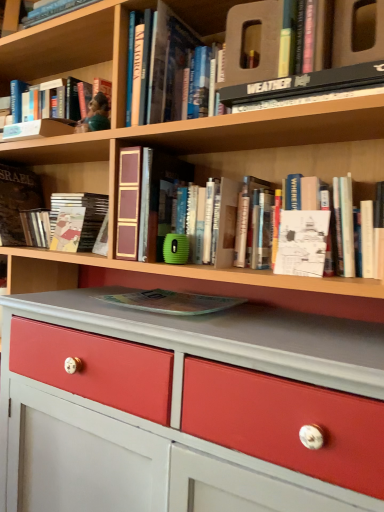
Question: From a real-world perspective, is black hardcover book at upper center, acting as the seventh book starting from the left, over white paper at center?

Choices:
 (A) no
 (B) yes

Answer: (B)

Question: Would you say black hardcover book at upper center, acting as the seventh book starting from the left, contains white paper at center?

Choices:
 (A) no
 (B) yes

Answer: (A)

Question: Can you confirm if black hardcover book at upper center, acting as the seventh book starting from the left, is taller than white paper at center?

Choices:
 (A) yes
 (B) no

Answer: (B)

Question: Would you say black hardcover book at upper center, the 2th book when ordered from right to left, is outside white paper at center?

Choices:
 (A) no
 (B) yes

Answer: (B)

Question: Is black hardcover book at upper center, the 2th book when ordered from right to left, looking in the opposite direction of white paper at center?

Choices:
 (A) yes
 (B) no

Answer: (B)

Question: Would you say black hardcover book at upper center, the 2th book when ordered from right to left, is to the left or to the right of white paper book at upper right, which is the eighth book from left to right, in the picture?

Choices:
 (A) left
 (B) right

Answer: (A)

Question: From a real-world perspective, is black hardcover book at upper center, the 2th book when ordered from right to left, physically located above or below white paper book at upper right, which is the eighth book from left to right?

Choices:
 (A) below
 (B) above

Answer: (B)

Question: Is point (369, 61) closer or farther from the camera than point (274, 148)?

Choices:
 (A) closer
 (B) farther

Answer: (A)

Question: Considering the positions of black hardcover book at upper center, the 2th book when ordered from right to left, and white paper book at upper right, placed as the 1th book when sorted from right to left, in the image, is black hardcover book at upper center, the 2th book when ordered from right to left, wider or thinner than white paper book at upper right, placed as the 1th book when sorted from right to left,?

Choices:
 (A) thin
 (B) wide

Answer: (B)

Question: In terms of width, does white paper book at upper right, which is the eighth book from left to right, look wider or thinner when compared to black hardcover book at upper center, the 2th book when ordered from right to left?

Choices:
 (A) thin
 (B) wide

Answer: (A)

Question: Based on their sizes in the image, would you say white paper book at upper right, placed as the 1th book when sorted from right to left, is bigger or smaller than black hardcover book at upper center, the 2th book when ordered from right to left?

Choices:
 (A) small
 (B) big

Answer: (B)

Question: Considering their positions, is white paper book at upper right, placed as the 1th book when sorted from right to left, located in front of or behind black hardcover book at upper center, acting as the seventh book starting from the left?

Choices:
 (A) behind
 (B) front

Answer: (A)

Question: Does point (274, 160) appear closer or farther from the camera than point (288, 92)?

Choices:
 (A) farther
 (B) closer

Answer: (A)

Question: From the image's perspective, is brown leather book at left, marked as the 8th book in a right-to-left arrangement, located above or below transparent plastic magazine at center, the fourth book positioned from the right?

Choices:
 (A) below
 (B) above

Answer: (B)

Question: Considering the positions of brown leather book at left, marked as the 8th book in a right-to-left arrangement, and transparent plastic magazine at center, which is the fifth book from left to right, in the image, is brown leather book at left, marked as the 8th book in a right-to-left arrangement, wider or thinner than transparent plastic magazine at center, which is the fifth book from left to right,?

Choices:
 (A) wide
 (B) thin

Answer: (B)